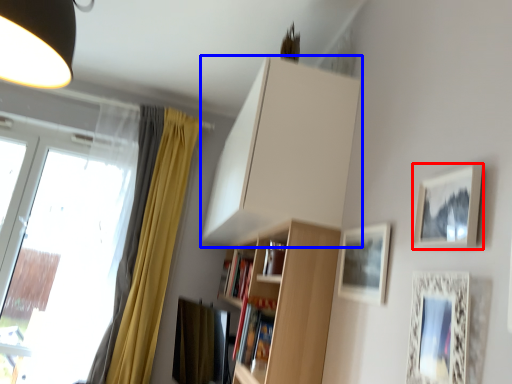
Question: Which point is closer to the camera, picture frame (highlighted by a red box) or cabinetry (highlighted by a blue box)?

Choices:
 (A) picture frame
 (B) cabinetry

Answer: (A)